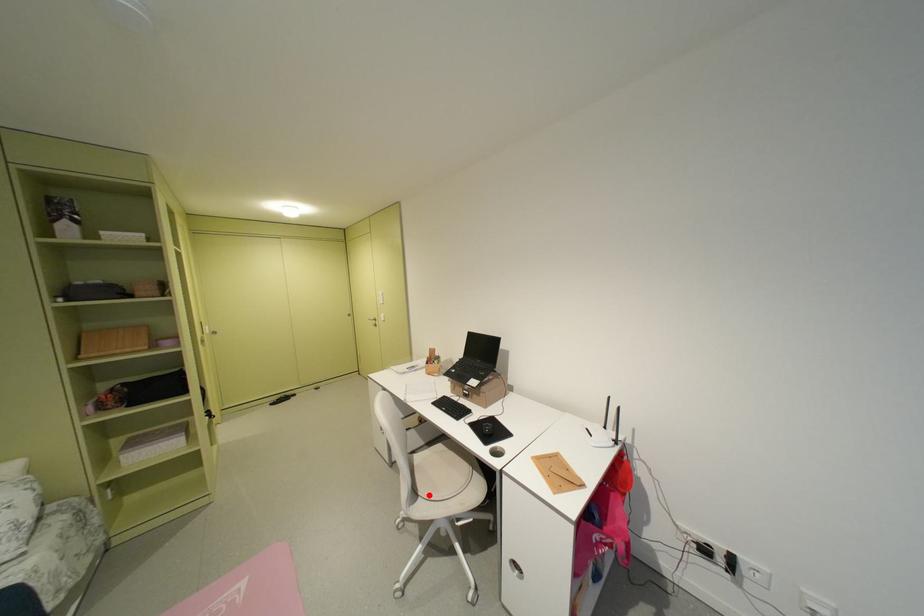
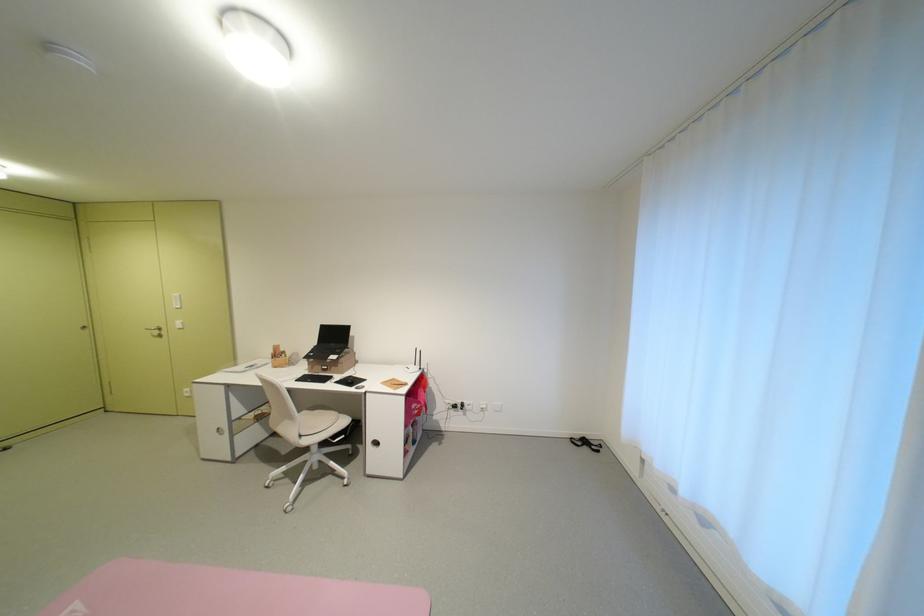
The point at the highlighted location is marked in the first image. Where is the corresponding point in the second image?

(311, 436)